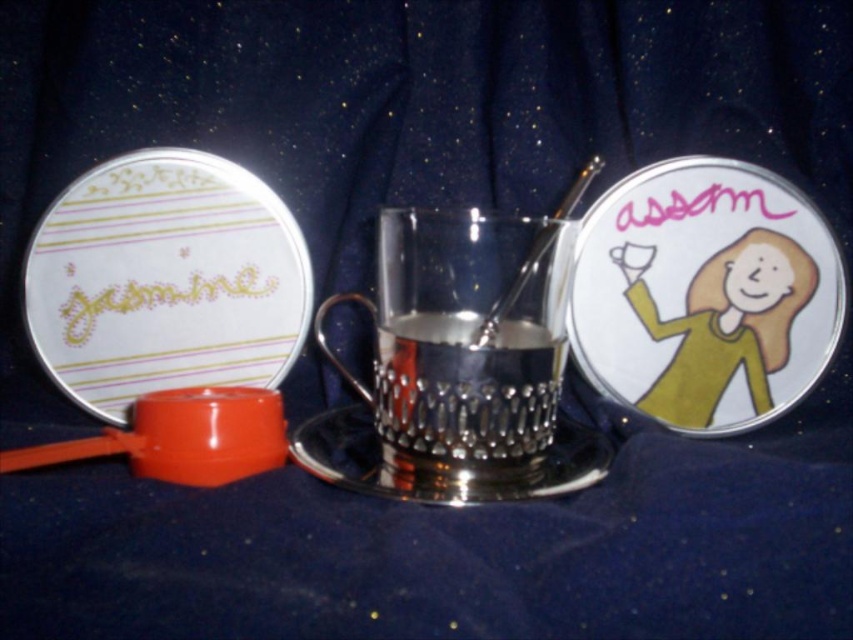
From the picture: You are a delivery person who needs to place a rectangular box that is 16 inches long on the table in front of you. There is a matte white plate at left on the table. Can you fit the box horizontally on the table without overlapping the plate?

The matte white plate at left and viewer are 15.71 inches apart. Since the box is 16 inches long, which is slightly longer than the distance from the plate to the viewer, it might not fit horizontally without overlapping the plate.

You are setting up a table for a tea party and need to place the matte white plate at left and the polished silver cup at center. Which item has a greater width?

The matte white plate at left has a greater width than the polished silver cup at center.